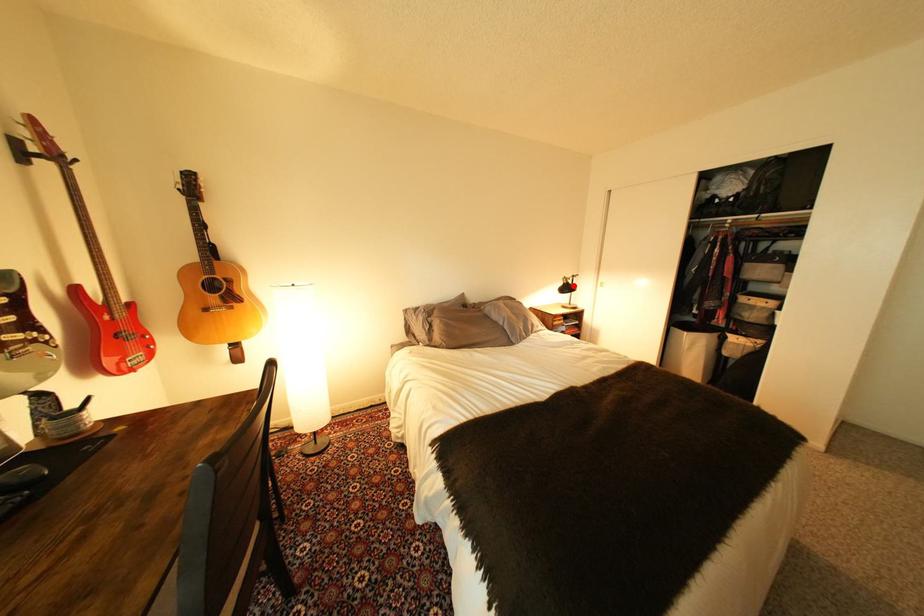
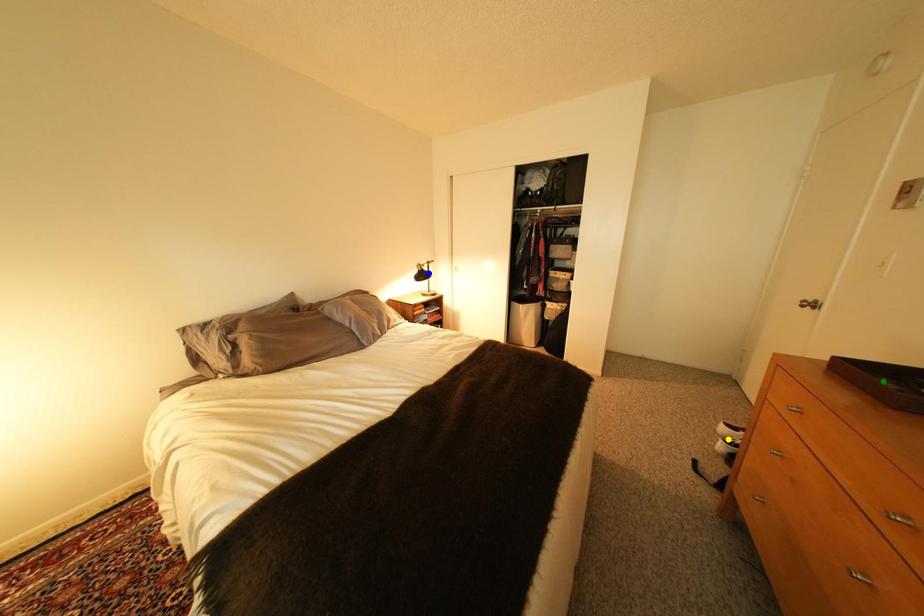
Question: I am providing you with two images of the same scene from different viewpoints. A red point is marked on the first image. You are given multiple points on the second image. Can you choose the point in image 2 that corresponds to the point in image 1?

Choices:
 (A) yellow point
 (B) green point
 (C) blue point

Answer: (C)